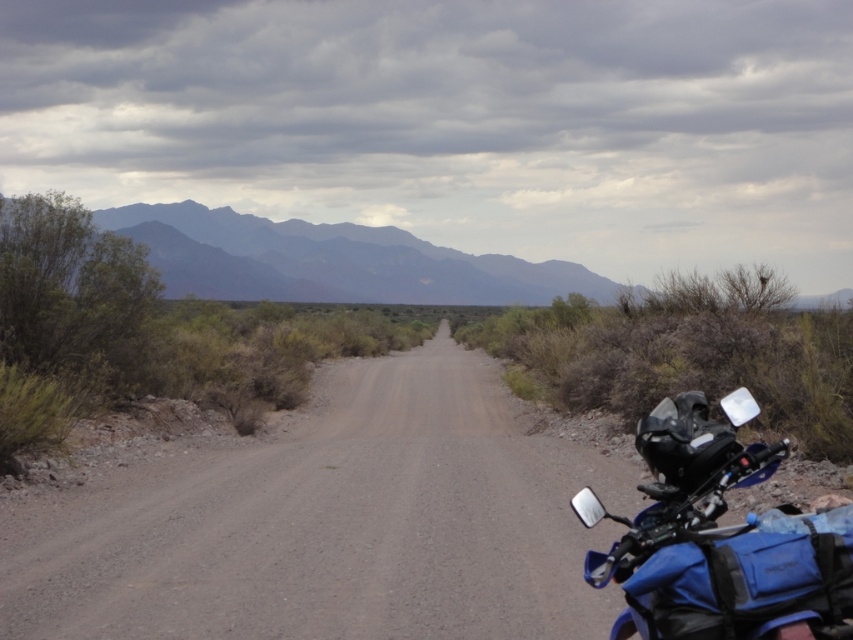
You are driving a car with a GPS that shows the route ahead. According to the image, will the dusty gravel road at center lead directly towards the gray textured mountains at upper center?

The dusty gravel road at center is in front of gray textured mountains at upper center, so the road is positioned between the viewer and the mountains. This suggests that the road leads directly towards the gray textured mountains at upper center.

You are a hiker planning to walk along the dusty gravel road at center. Considering the position of the gray textured mountains at upper center, which direction should you face to have the mountains in your view ahead of you?

The dusty gravel road at center is located below the gray textured mountains at upper center. So, if you face towards the mountains, you will have them in your view ahead while walking along the road.

You are a hiker standing at point [817,557] and want to walk towards the mountains in the background. There is a point at [415,595] that you can see. Is this point in front of or behind your current position?

The point at [415,595] is behind your current position at [817,557], so it is behind you.